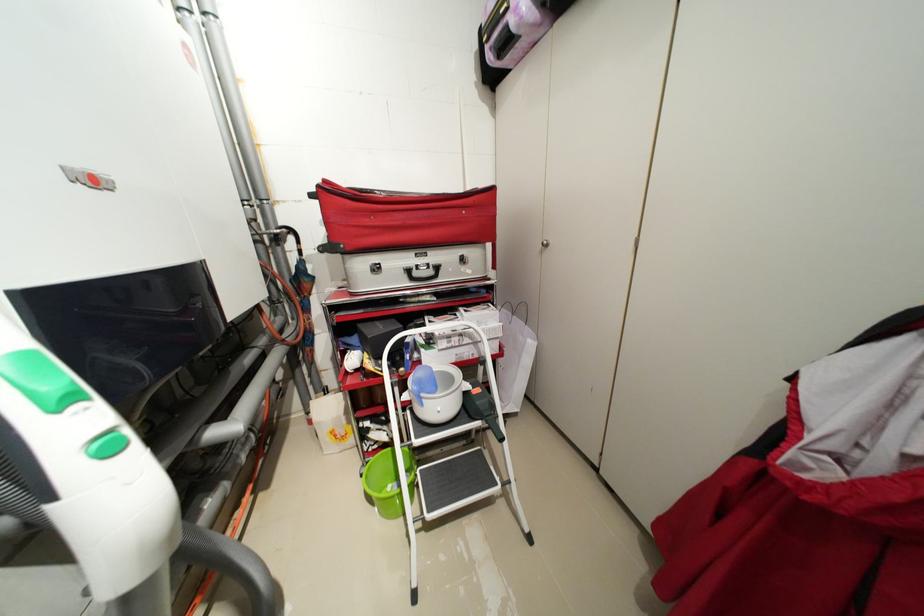
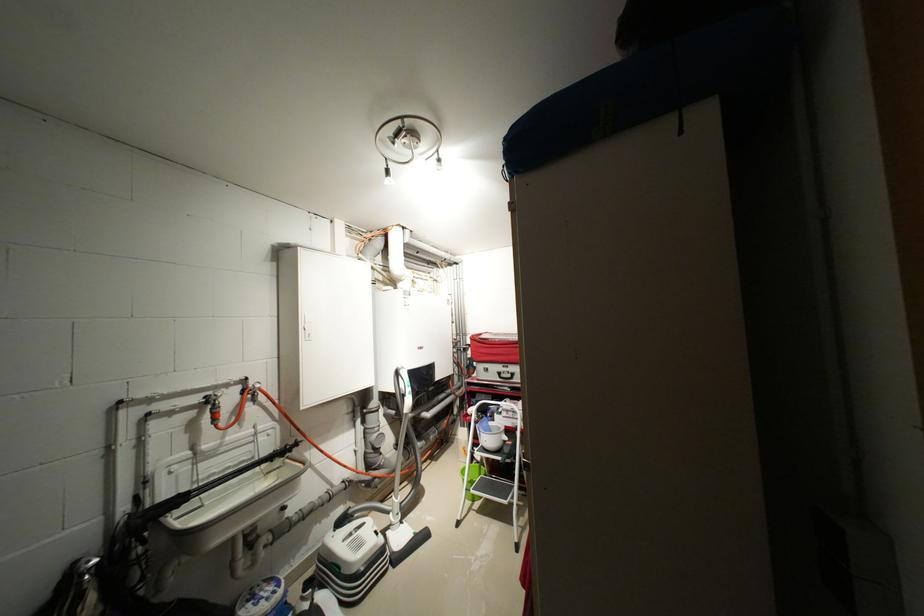
Find the pixel in the second image that matches pixel 456 338 in the first image.

(515, 411)